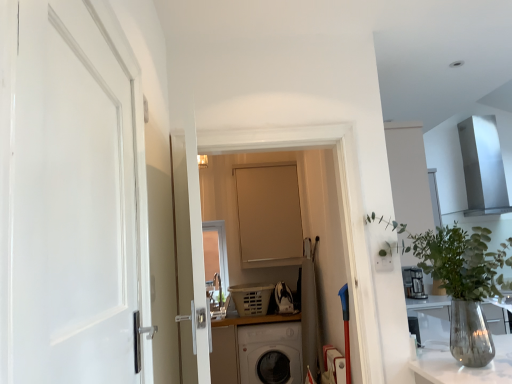
Question: Is clear glass vase at right inside the boundaries of matte beige door at center, the first door viewed from the right, or outside?

Choices:
 (A) outside
 (B) inside

Answer: (A)

Question: Looking at their shapes, would you say clear glass vase at right is wider or thinner than matte beige door at center, the 2th door in the front-to-back sequence?

Choices:
 (A) thin
 (B) wide

Answer: (B)

Question: Which is farther from the white matte door at left, the 1th door when ordered from front to back?

Choices:
 (A) matte beige door at center, the second door when ordered from left to right
 (B) clear glass vase at right

Answer: (A)

Question: Which of these objects is positioned closest to the clear glass vase at right?

Choices:
 (A) matte beige door at center, arranged as the first door when viewed from the back
 (B) white matte door at left, which appears as the first door when viewed from the left

Answer: (B)